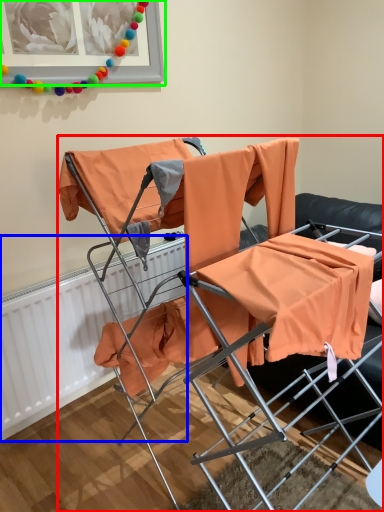
Question: Considering the real-world distances, which object is closest to chair (highlighted by a red box)? radiator (highlighted by a blue box) or picture frame (highlighted by a green box).

Choices:
 (A) radiator
 (B) picture frame

Answer: (A)